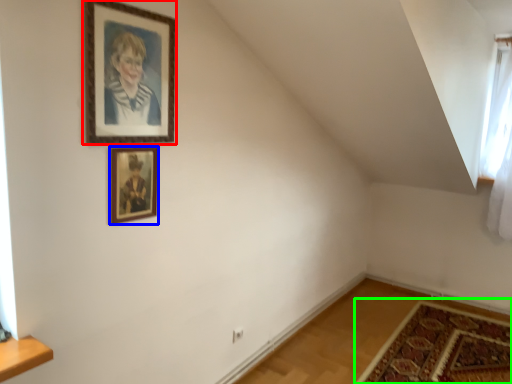
Question: Based on their relative distances, which object is farther from picture frame (highlighted by a red box)? Choose from picture frame (highlighted by a blue box) and mat (highlighted by a green box).

Choices:
 (A) picture frame
 (B) mat

Answer: (B)